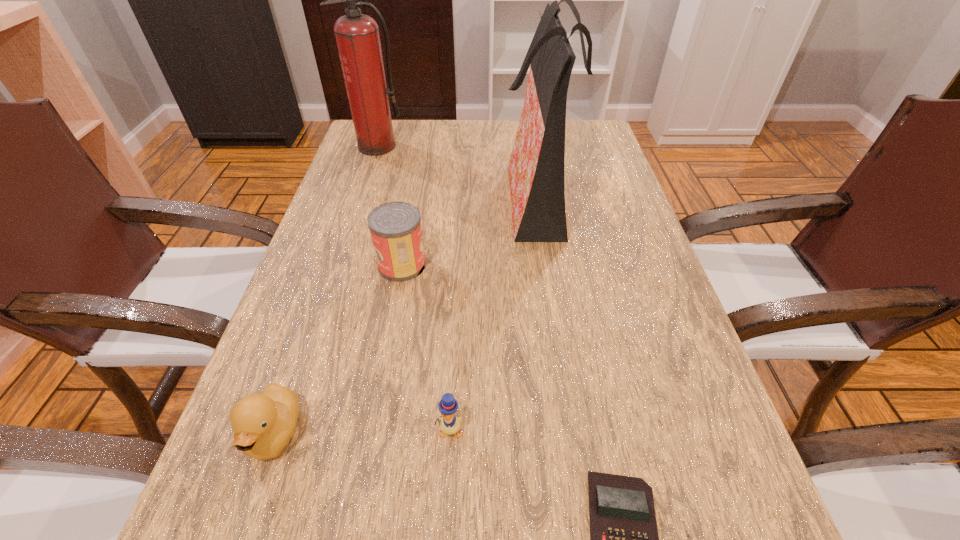
Image resolution: width=960 pixels, height=540 pixels. In order to click on object that is at the right edge in this screenshot , I will do `click(536, 167)`.

At what (x,y) coordinates should I click in order to perform the action: click on object present at the far left corner. Please return your answer as a coordinate pair (x, y). This screenshot has height=540, width=960. Looking at the image, I should click on (357, 35).

The width and height of the screenshot is (960, 540). Identify the location of object present at the far right corner. (536, 167).

Where is `free space at the far edge of the desktop`? The width and height of the screenshot is (960, 540). free space at the far edge of the desktop is located at coordinates (477, 140).

The image size is (960, 540). Identify the location of vacant space at the left edge. (356, 284).

Identify the location of vacant region at the right edge of the desktop. This screenshot has width=960, height=540. (656, 319).

At what (x,y) coordinates should I click in order to perform the action: click on vacant space at the far right corner. Please return your answer as a coordinate pair (x, y). The height and width of the screenshot is (540, 960). Looking at the image, I should click on (597, 138).

Where is `free spot between the farthest object and the shopping bag`? free spot between the farthest object and the shopping bag is located at coordinates (457, 171).

Locate an element on the screen. free point between the third object from right to left and the can is located at coordinates (425, 347).

Identify the location of free spot between the shopping bag and the farthest object. (457, 171).